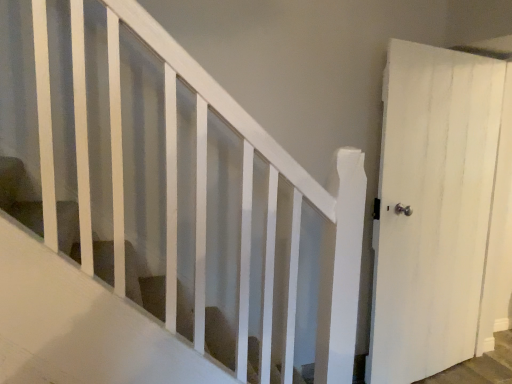
Question: Should I look upward or downward to see white matte door at right?

Choices:
 (A) up
 (B) down

Answer: (B)